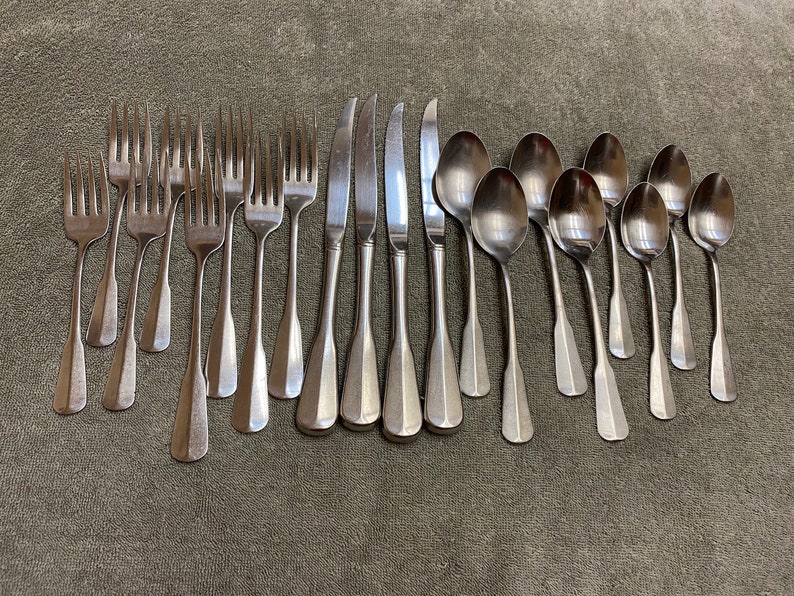
The image size is (794, 596). What are the coordinates of `fork` in the screenshot? It's located at (301, 169), (275, 184), (237, 166), (214, 193), (197, 175), (144, 216), (129, 153), (89, 203).